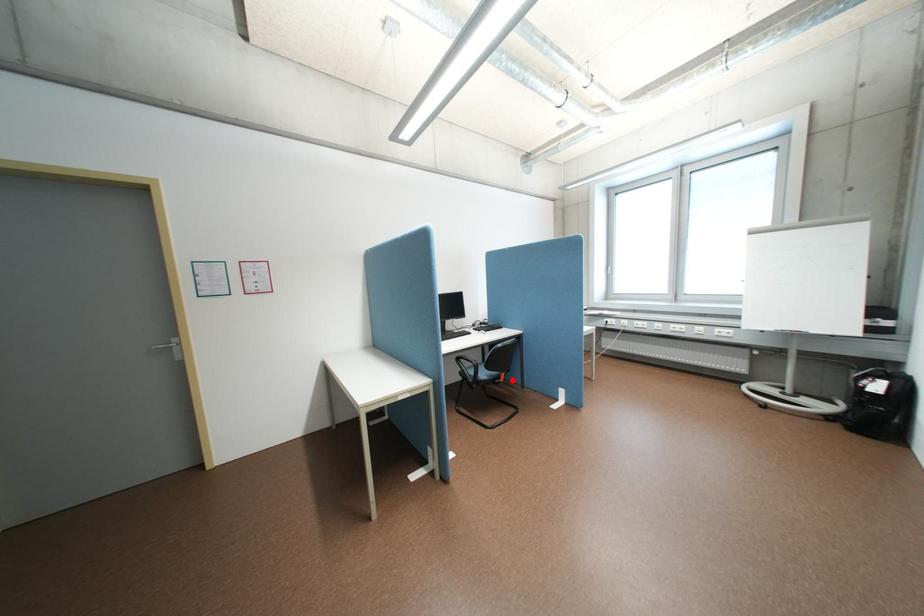
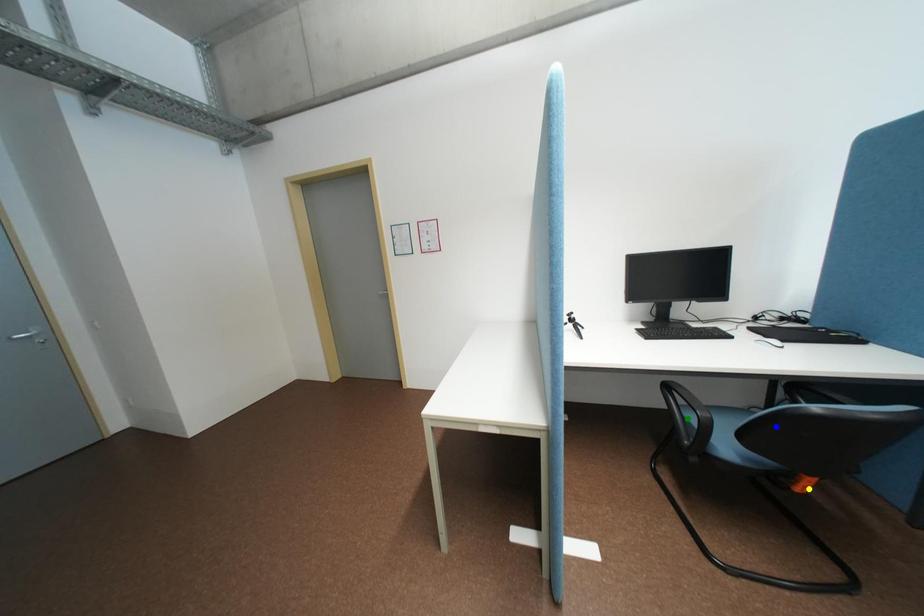
Question: I am providing you with two images of the same scene from different viewpoints. A red point is marked on the first image. You are given multiple points on the second image. Which point in image 2 is actually the same real-world point as the red point in image 1?

Choices:
 (A) yellow point
 (B) green point
 (C) blue point

Answer: (A)